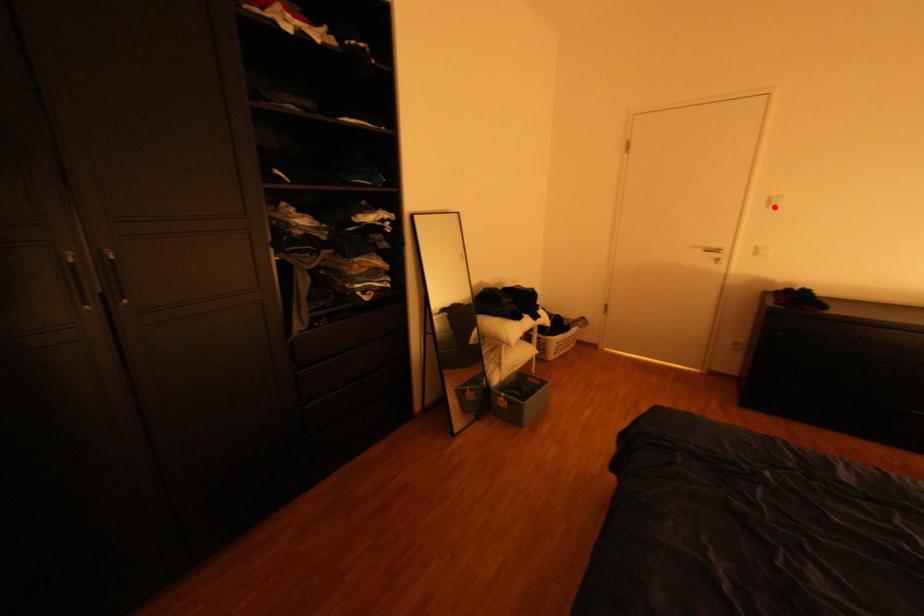
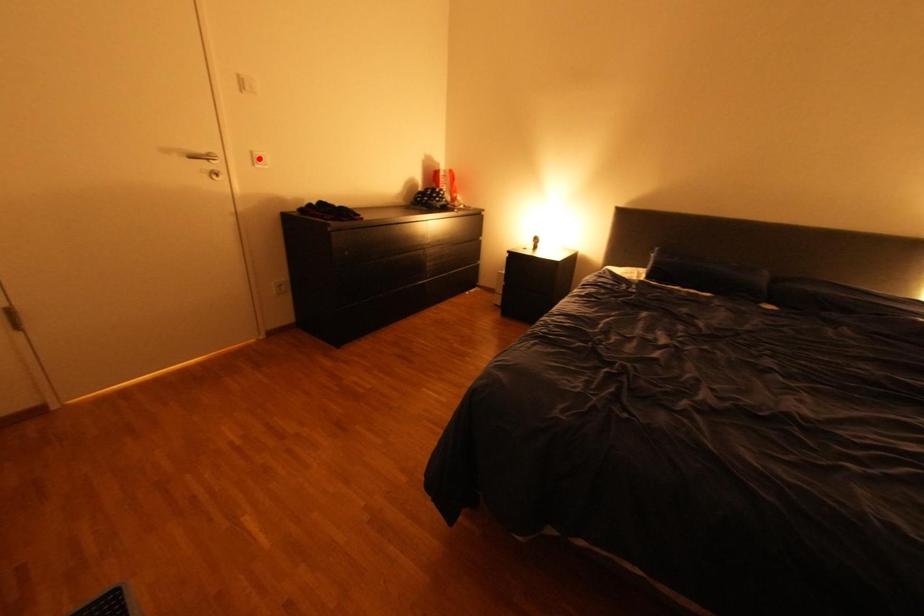
I am providing you with two images of the same scene from different viewpoints. A red point is marked on the first image and another point is marked on the second image. Are the points marked in image1 and image2 representing the same 3D position?

No